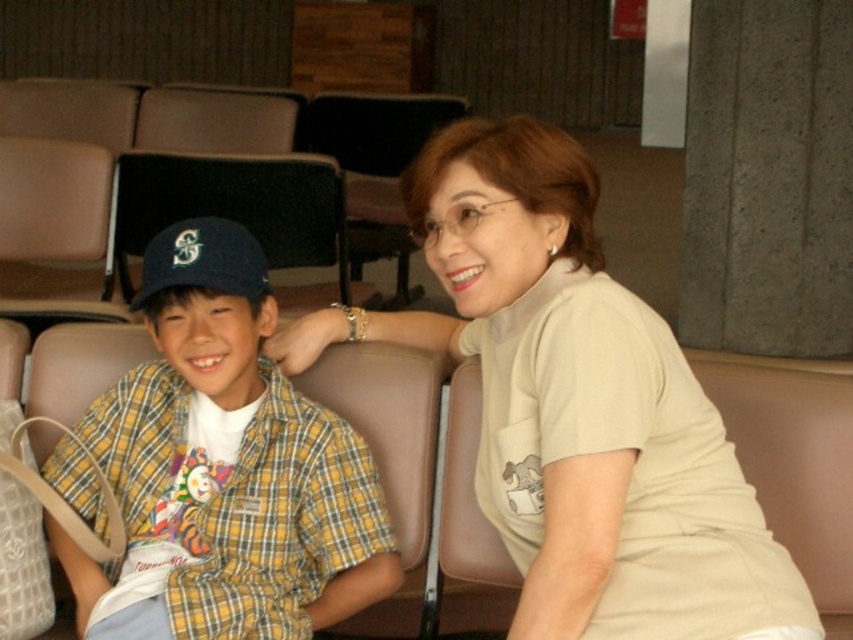
You are a photographer trying to capture a candid shot of the two people in the scene. You notice the yellow plaid shirt at left and the matte black cap at left. Which object should you focus on if you want to capture the larger one in your frame?

The matte black cap at left is larger than the yellow plaid shirt at left, so focusing on the matte black cap at left would capture the larger object in the frame.

You are a photographer trying to capture a candid shot of the yellow plaid shirt at left and the matte blue baseball cap at left in the image. Which object should you focus on first if you want to ensure both are in the frame?

The yellow plaid shirt at left is positioned under the matte blue baseball cap at left, so you should focus on the matte blue baseball cap at left first to ensure both are in the frame.

You are a photographer trying to capture a candid shot of the yellow plaid shirt at left and the matte black cap at left. Since you want to ensure both are in focus, you need to know their vertical positions. Which one is positioned lower in the image?

The yellow plaid shirt at left is located below the matte black cap at left, so the yellow plaid shirt at left is positioned lower in the image.